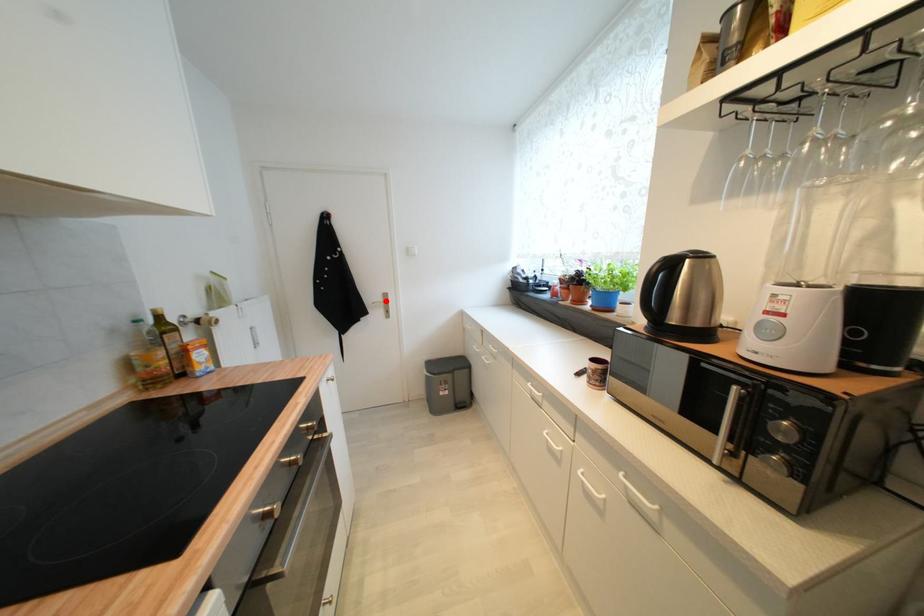
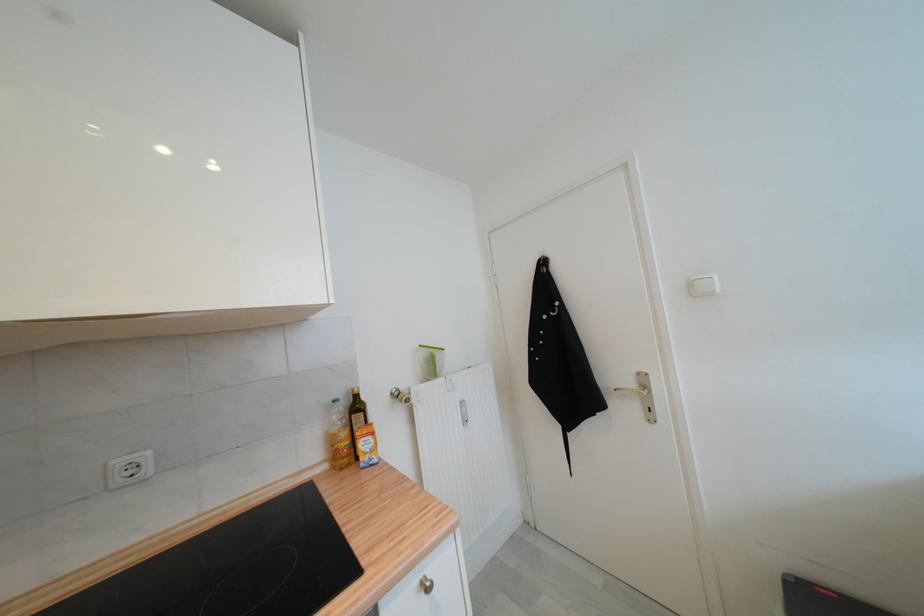
Question: I am providing you with two images of the same scene from different viewpoints. Given a red point in image1, look at the same physical point in image2. Is it:

Choices:
 (A) Closer to the viewpoint
 (B) Farther from the viewpoint

Answer: (B)